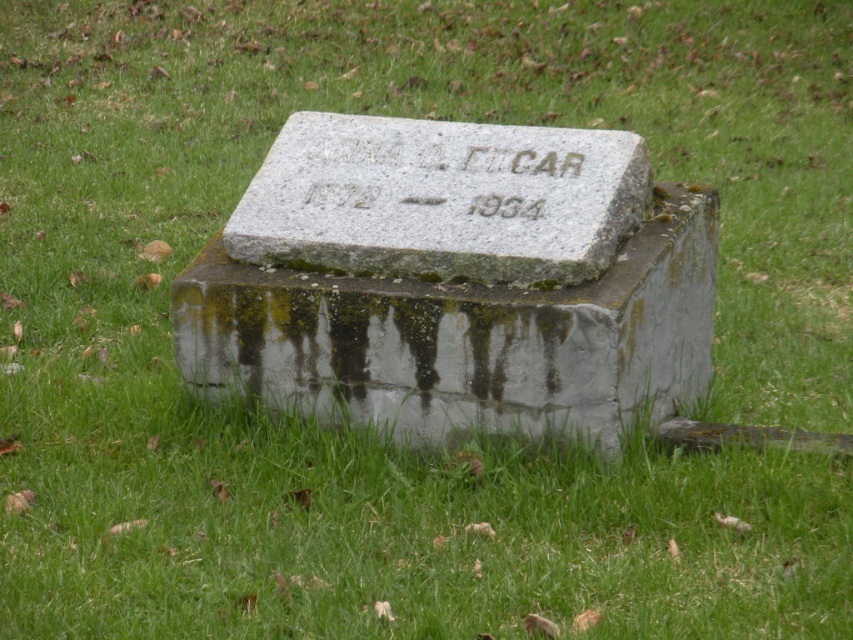
From the picture: Is gray stone marker at center to the left of etched granite stone at center from the viewer's perspective?

Correct, you'll find gray stone marker at center to the left of etched granite stone at center.

Who is positioned more to the left, gray stone marker at center or etched granite stone at center?

gray stone marker at center is more to the left.

Does point (229, 218) lie in front of point (430, 173)?

No, it is not.

Identify the location of gray stone marker at center. The image size is (853, 640). (440, 200).

This screenshot has height=640, width=853. Describe the element at coordinates (465, 340) in the screenshot. I see `gray stone gravestone at center` at that location.

Consider the image. Which is more to the left, gray stone gravestone at center or etched granite stone at center?

Positioned to the left is etched granite stone at center.

Describe the element at coordinates (465, 340) in the screenshot. I see `gray stone gravestone at center` at that location.

Image resolution: width=853 pixels, height=640 pixels. I want to click on gray stone gravestone at center, so click(x=465, y=340).

Where is `gray stone gravestone at center`? Image resolution: width=853 pixels, height=640 pixels. gray stone gravestone at center is located at coordinates (465, 340).

Find the location of a particular element. gray stone gravestone at center is located at coordinates (465, 340).